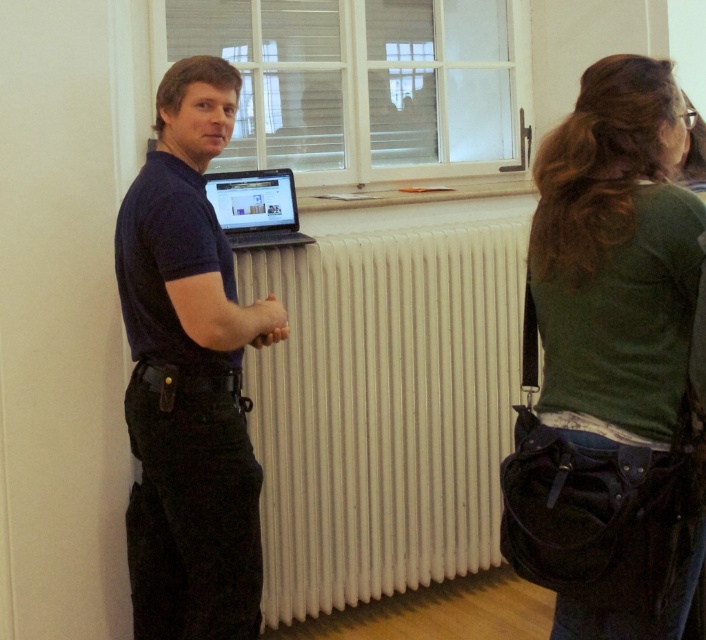
You are standing in the room and need to hand a tool to the person wearing the green fabric shirt at upper right. Where should you approach to give it to them?

The green fabric shirt at upper right is located at point (x=611, y=365), so you should approach that coordinate to hand the tool to the person wearing the green fabric shirt at upper right.

You are standing in the room and want to place a 2.5 feet wide box on the white ribbed radiator at center. Can you determine if the radiator is wide enough to hold the box?

The white ribbed radiator at center is 8.36 feet from viewer, so the distance from the viewer does not indicate its width. The radiator width is not provided, so it is impossible to determine if it can hold the 2.5 feet wide box.

You are a visitor in this room and want to place your phone on the nearest surface. The white ribbed radiator at center and the matte black laptop at center are both in your line of sight. Which object should you choose to place your phone?

The white ribbed radiator at center is to the right of the matte black laptop at center, so the nearest surface depends on your position. However, since the laptop is on the radiator, placing the phone on the radiator would be more stable and safer than the laptop.